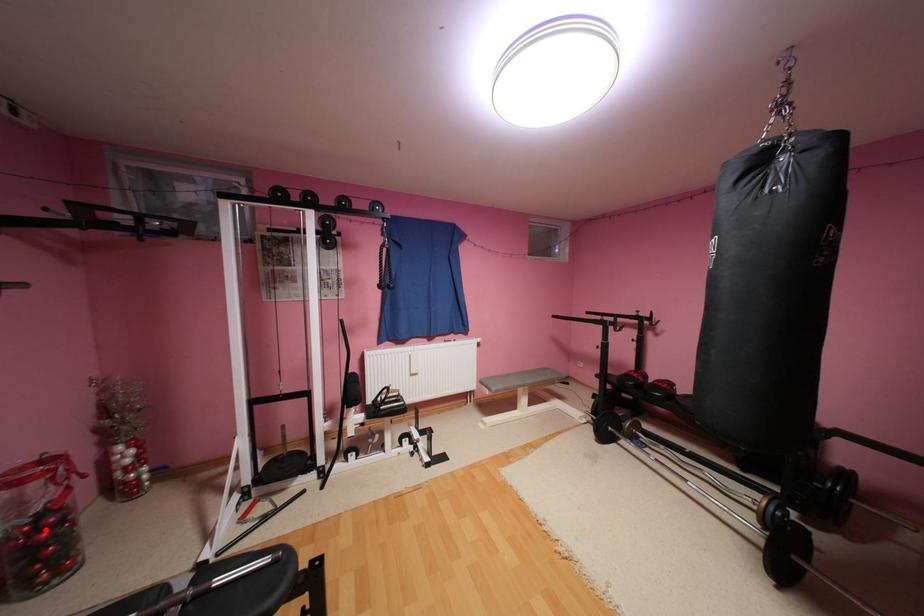
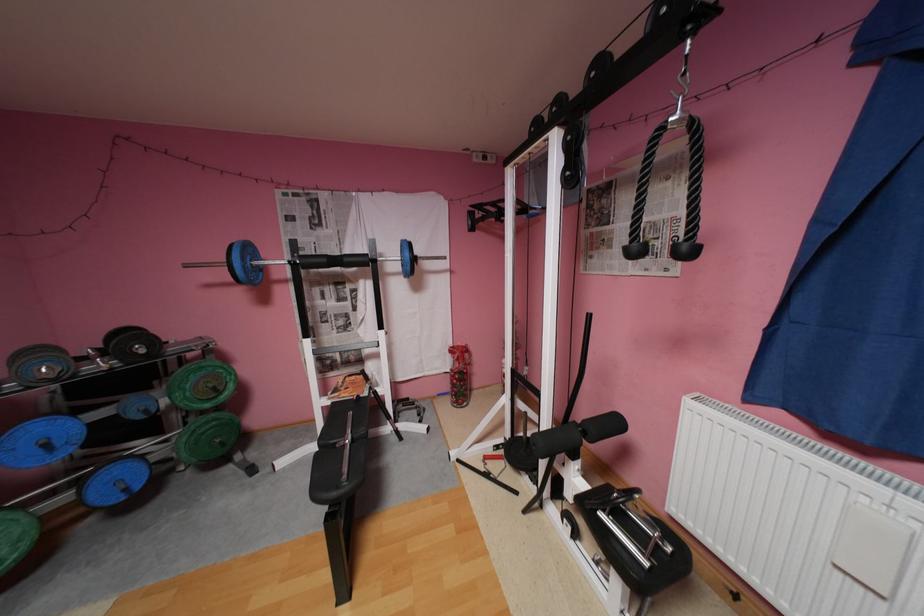
Question: I am providing you with two images of the same scene from different viewpoints. A red point is marked on the first image. At the location where the point appears in image 1, is it still visible in image 2?

Choices:
 (A) Yes
 (B) No

Answer: (A)